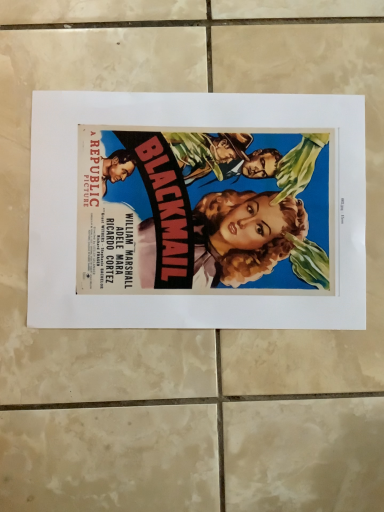
Locate an element on the screen. The height and width of the screenshot is (512, 384). vivid paper poster at center is located at coordinates click(197, 211).

What do you see at coordinates (197, 211) in the screenshot?
I see `vivid paper poster at center` at bounding box center [197, 211].

Measure the distance between point (278, 306) and camera.

A distance of 14.72 inches exists between point (278, 306) and camera.

I want to click on vivid paper poster at center, so click(197, 211).